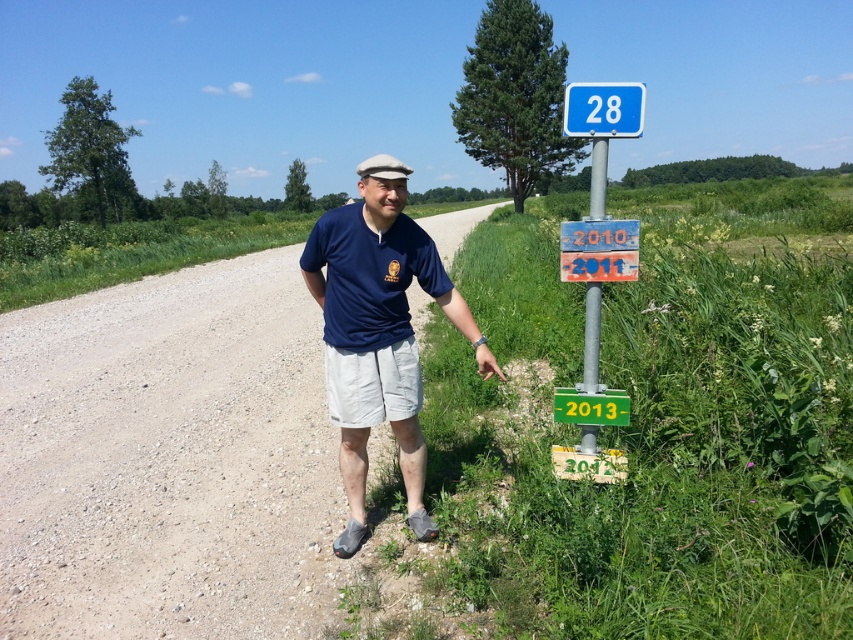
How far apart are blue plastic sign at upper right and white matte baseball hat at upper center?

blue plastic sign at upper right is 1.78 meters from white matte baseball hat at upper center.

Can you confirm if blue plastic sign at upper right is bigger than white matte baseball hat at upper center?

Incorrect, blue plastic sign at upper right is not larger than white matte baseball hat at upper center.

What do you see at coordinates (598, 212) in the screenshot?
I see `blue plastic sign at upper right` at bounding box center [598, 212].

Locate an element on the screen. This screenshot has width=853, height=640. blue plastic sign at upper right is located at coordinates (598, 212).

Can you confirm if navy blue t-shirt at center is positioned above green plastic sign at right?

Correct, navy blue t-shirt at center is located above green plastic sign at right.

Who is positioned more to the left, navy blue t-shirt at center or green plastic sign at right?

From the viewer's perspective, navy blue t-shirt at center appears more on the left side.

This screenshot has height=640, width=853. Describe the element at coordinates (378, 339) in the screenshot. I see `navy blue t-shirt at center` at that location.

You are a GUI agent. You are given a task and a screenshot of the screen. Output one action in this format:
    pyautogui.click(x=<x>, y=<y>)
    Task: Click on the navy blue t-shirt at center
    
    Given the screenshot: What is the action you would take?
    pyautogui.click(x=378, y=339)

Between point (321, 280) and point (363, 163), which one is positioned in front?

Point (321, 280)

Can you confirm if navy blue t-shirt at center is wider than white matte baseball hat at upper center?

No.

I want to click on navy blue t-shirt at center, so click(x=378, y=339).